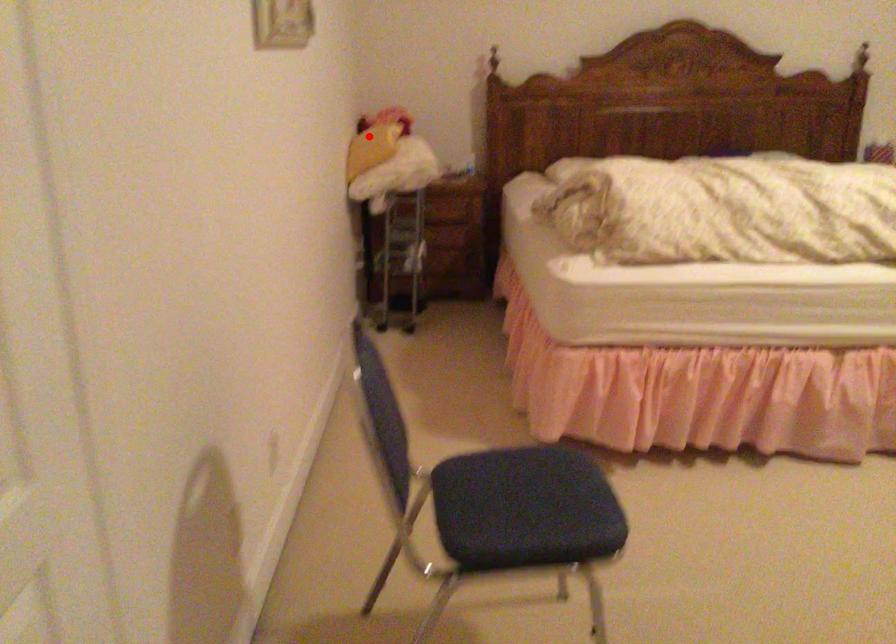
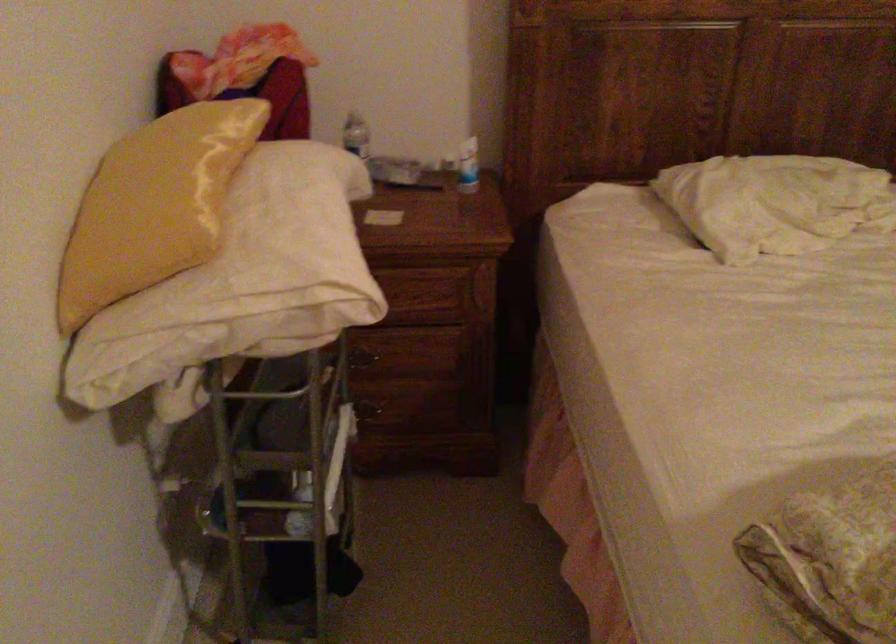
The point at the highlighted location is marked in the first image. Where is the corresponding point in the second image?

(153, 205)